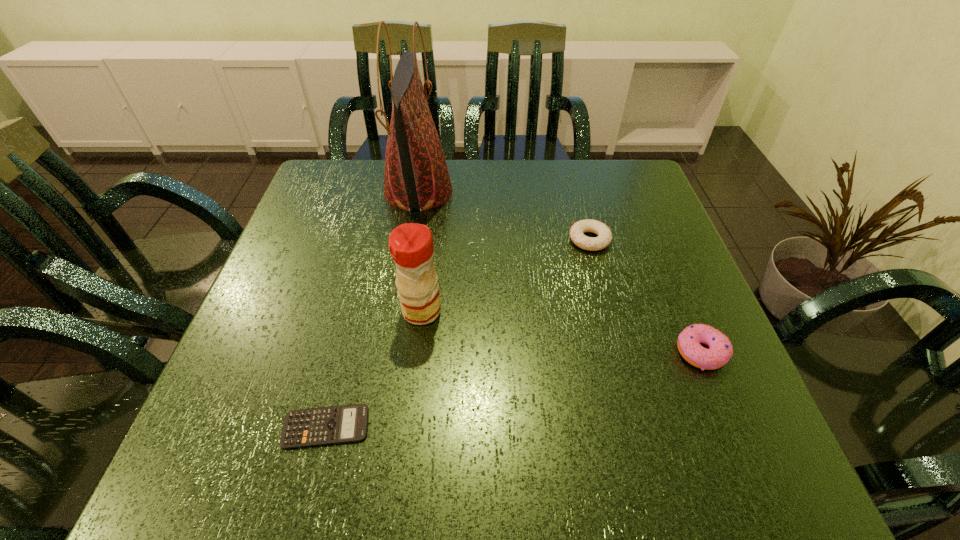
In the image, there is a desktop. Where is `vacant space at the near edge`? This screenshot has width=960, height=540. vacant space at the near edge is located at coordinates (325, 453).

Where is `vacant space at the left edge`? Image resolution: width=960 pixels, height=540 pixels. vacant space at the left edge is located at coordinates (319, 252).

Find the location of a particular element. vacant space at the right edge is located at coordinates (684, 295).

In the image, there is a desktop. Identify the location of vacant space at the far left corner. (359, 160).

In the image, there is a desktop. Identify the location of free space at the near left corner. (277, 430).

Find the location of a particular element. free point between the left doughnut and the third farthest object is located at coordinates (506, 275).

At what (x,y) coordinates should I click in order to perform the action: click on free space between the third farthest object and the nearer doughnut. Please return your answer as a coordinate pair (x, y). Looking at the image, I should click on (561, 332).

At what (x,y) coordinates should I click in order to perform the action: click on free space between the right doughnut and the tallest object. Please return your answer as a coordinate pair (x, y). Looking at the image, I should click on (560, 272).

Find the location of `vacant point located between the condiment and the left doughnut`. vacant point located between the condiment and the left doughnut is located at coordinates (506, 275).

Find the location of a particular element. Image resolution: width=960 pixels, height=540 pixels. free area in between the taller doughnut and the calculator is located at coordinates (514, 389).